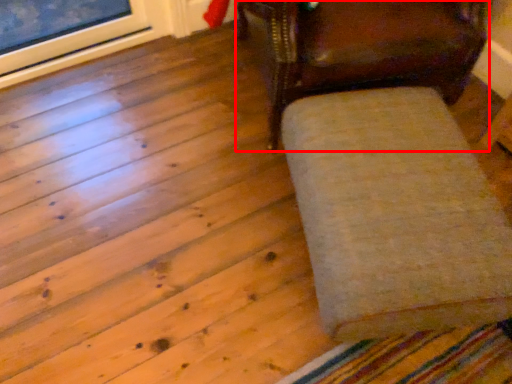
Question: From the image's perspective, what is the correct spatial relationship of chair (annotated by the red box) in relation to furniture?

Choices:
 (A) above
 (B) below

Answer: (A)